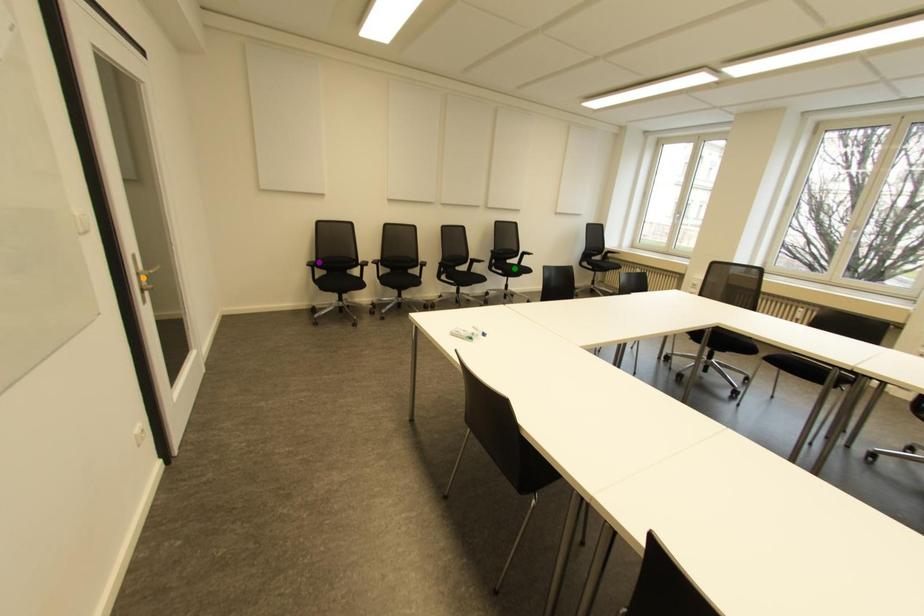
Order these from nearest to farthest:
green point | purple point | orange point

orange point → purple point → green point